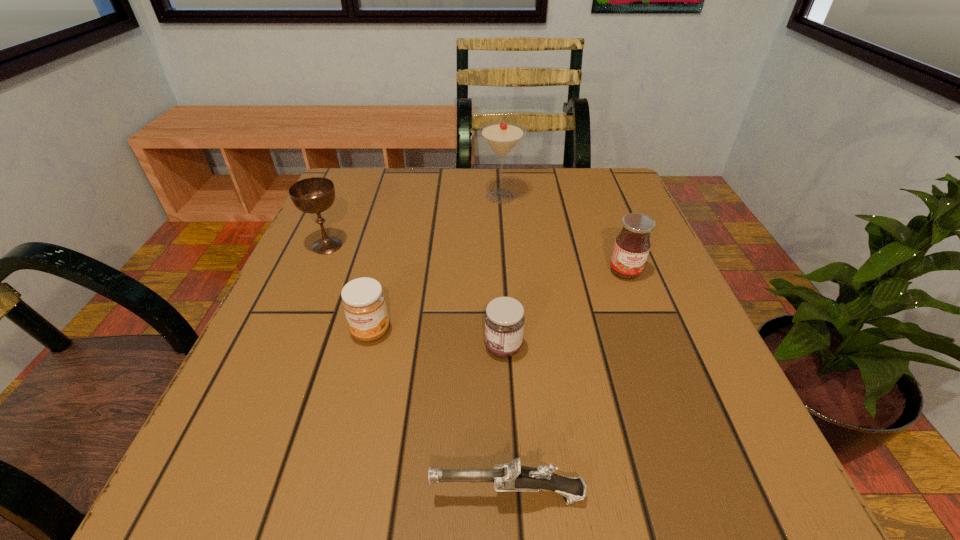
The height and width of the screenshot is (540, 960). I want to click on the closest jam to the second object from left to right, so click(504, 319).